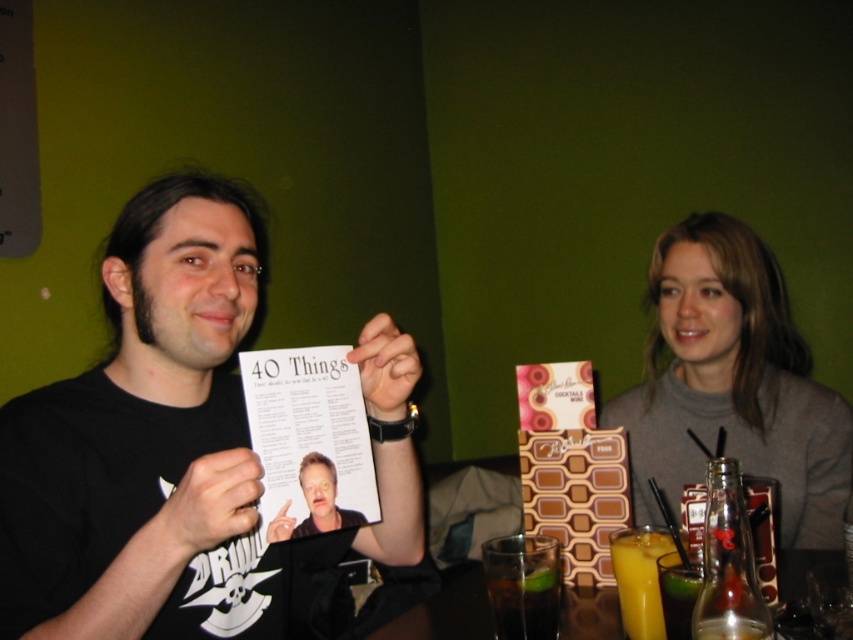
Question: Which point is closer to the camera?

Choices:
 (A) (281, 440)
 (B) (788, 337)
 (C) (640, 616)
 (D) (177, 618)

Answer: (A)

Question: Among these objects, which one is farthest from the camera?

Choices:
 (A) clear glass bottle at lower right
 (B) white paper menu at center

Answer: (B)

Question: Does white paper menu at center have a lesser width compared to smooth skin face at center?

Choices:
 (A) no
 (B) yes

Answer: (A)

Question: Which point is closer to the camera taking this photo?

Choices:
 (A) (671, 627)
 (B) (747, 396)

Answer: (A)

Question: Can you confirm if translucent glass juice at lower right is positioned above translucent glass at lower right?

Choices:
 (A) yes
 (B) no

Answer: (A)

Question: Can you confirm if black matte paper at center is bigger than translucent glass table at lower center?

Choices:
 (A) yes
 (B) no

Answer: (A)